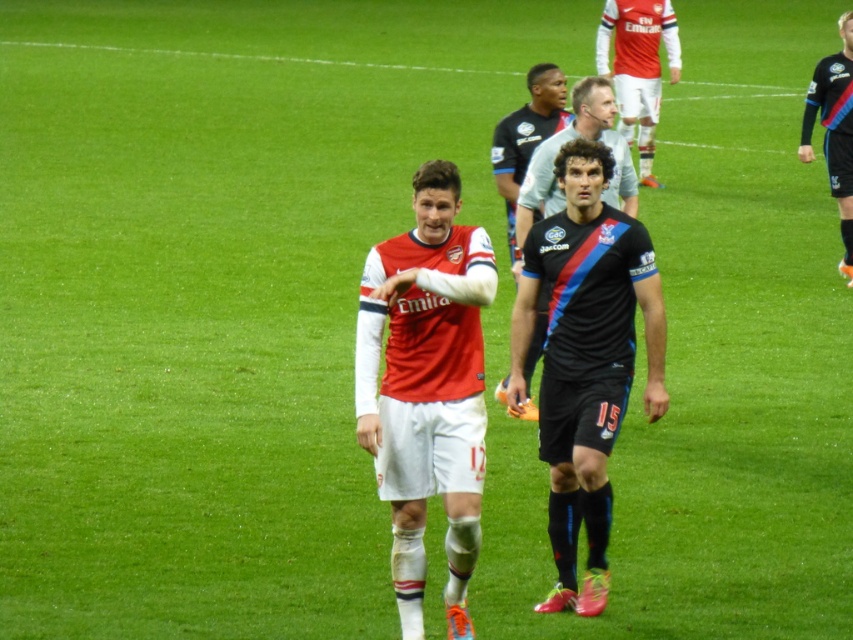
You are a soccer player on the field and you see the point marked at coordinates (637, 67). What object is located at that point?

The point at coordinates (637, 67) has a matte jersey at upper center.

You are a soccer coach analyzing the players on the field. You notice the matte jersey at upper center and the black jersey at center. Which of these two jerseys appears to be bigger in size?

The matte jersey at upper center is larger in size compared to the black jersey at center.

You are a soccer player positioned at the center circle and want to pass the ball to the point closer to the camera between point (412, 582) and point (621, 54). Which point should you aim for?

You should aim for point (412, 582) because it is closer to the camera than point (621, 54).